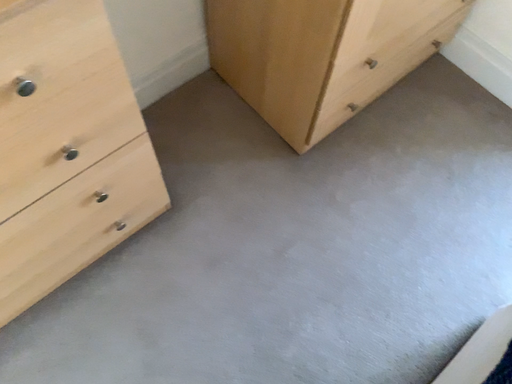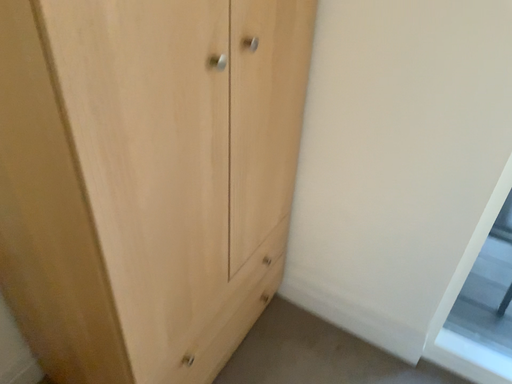
Question: Which way did the camera rotate in the video?

Choices:
 (A) rotated downward
 (B) rotated upward

Answer: (B)